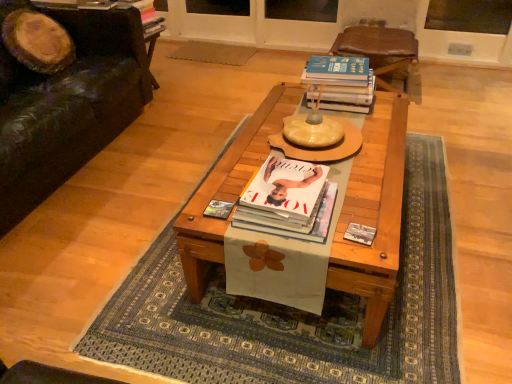
Question: Considering the relative positions of wooden coffee table at center and white glossy book at center, the 1th book from the bottom, in the image provided, is wooden coffee table at center in front of white glossy book at center, the 1th book from the bottom,?

Choices:
 (A) yes
 (B) no

Answer: (A)

Question: From a real-world perspective, is wooden coffee table at center positioned over white glossy book at center, the 2th book from the back, based on gravity?

Choices:
 (A) no
 (B) yes

Answer: (A)

Question: Considering the relative sizes of wooden coffee table at center and white glossy book at center, which is counted as the 2th book, starting from the right, in the image provided, is wooden coffee table at center smaller than white glossy book at center, which is counted as the 2th book, starting from the right,?

Choices:
 (A) yes
 (B) no

Answer: (B)

Question: Does wooden coffee table at center appear on the right side of white glossy book at center, which appears as the first book when viewed from the left?

Choices:
 (A) no
 (B) yes

Answer: (B)

Question: Is wooden coffee table at center oriented away from white glossy book at center, which appears as the first book when viewed from the left?

Choices:
 (A) yes
 (B) no

Answer: (B)

Question: Could you tell me if wooden coffee table at center is facing white glossy book at center, the 1th book from the bottom?

Choices:
 (A) no
 (B) yes

Answer: (A)

Question: Is matte paper magazine at center aimed at white glossy book at center, the 2th book from the back?

Choices:
 (A) yes
 (B) no

Answer: (B)

Question: Does matte paper magazine at center have a smaller size compared to white glossy book at center, acting as the 2th book starting from the top?

Choices:
 (A) no
 (B) yes

Answer: (B)

Question: Can you confirm if matte paper magazine at center is taller than white glossy book at center, the 1th book from the bottom?

Choices:
 (A) yes
 (B) no

Answer: (B)

Question: From a real-world perspective, does matte paper magazine at center stand above white glossy book at center, which ranks as the 1th book in front-to-back order?

Choices:
 (A) yes
 (B) no

Answer: (B)

Question: From the image's perspective, is matte paper magazine at center located above white glossy book at center, acting as the 2th book starting from the top?

Choices:
 (A) no
 (B) yes

Answer: (A)

Question: Can you confirm if matte paper magazine at center is positioned to the right of white glossy book at center, which ranks as the 1th book in front-to-back order?

Choices:
 (A) no
 (B) yes

Answer: (A)

Question: Is matte yellow round table at center in contact with black leather couch at left?

Choices:
 (A) yes
 (B) no

Answer: (B)